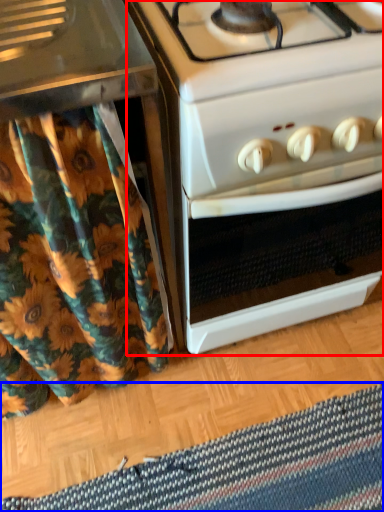
Question: Which point is closer to the camera, oven (highlighted by a red box) or mat (highlighted by a blue box)?

Choices:
 (A) oven
 (B) mat

Answer: (A)